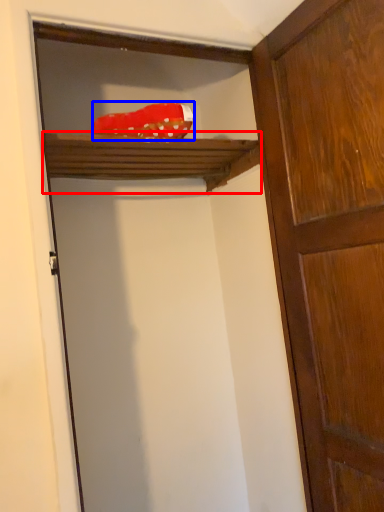
Question: Which point is further to the camera, shelf (highlighted by a red box) or material (highlighted by a blue box)?

Choices:
 (A) shelf
 (B) material

Answer: (A)